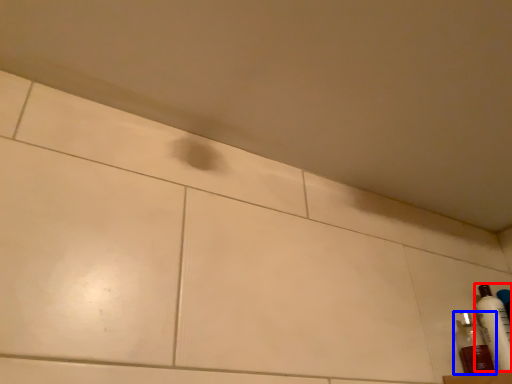
Question: Which of the following is the farthest to the observer, bottle (highlighted by a red box) or bottle (highlighted by a blue box)?

Choices:
 (A) bottle
 (B) bottle

Answer: (A)